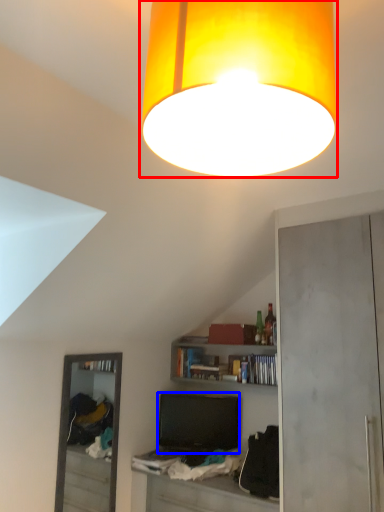
Question: Which point is further to the camera, lamp (highlighted by a red box) or television (highlighted by a blue box)?

Choices:
 (A) lamp
 (B) television

Answer: (B)